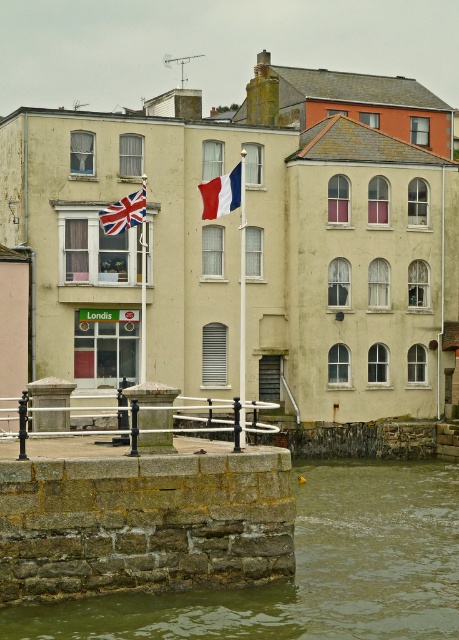
You are a tourist standing at the riverside and want to take a photo of the brown stone wall at lower left without the smooth metal railing at center appearing in the frame. How should you adjust your position?

Move your camera downward so that the brown stone wall at lower left is framed below the smooth metal railing at center.

You are standing on the stone embankment and want to reach the union jack fabric flag at upper left. Which direction should you move relative to the brown stone wall at lower left?

To reach the union jack fabric flag at upper left, you should move upward from the brown stone wall at lower left since it is positioned below the flag.

You are standing at the edge of the riverside and want to know the exact coordinates of the smooth metal railing at center. What are they?

The smooth metal railing at center is located at coordinates (161, 419).